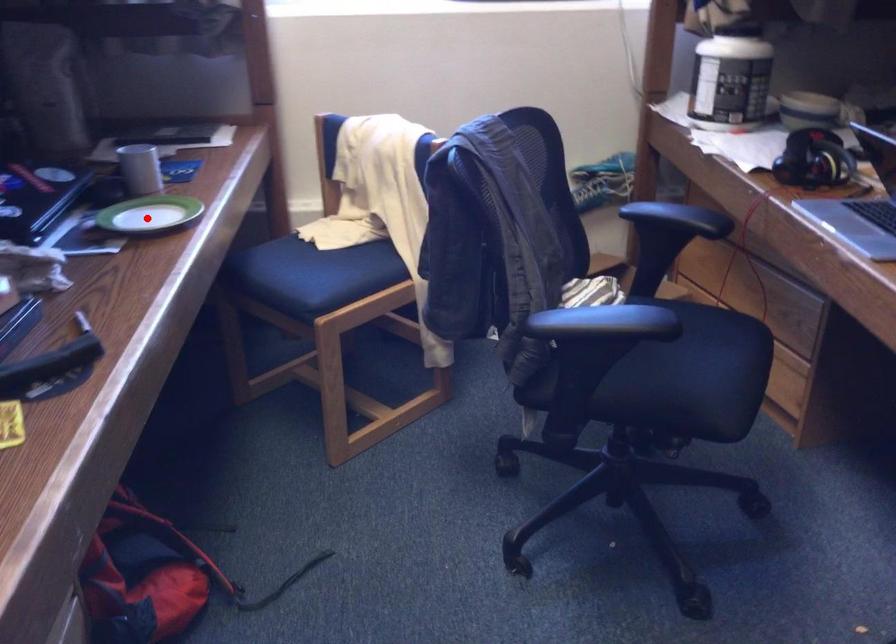
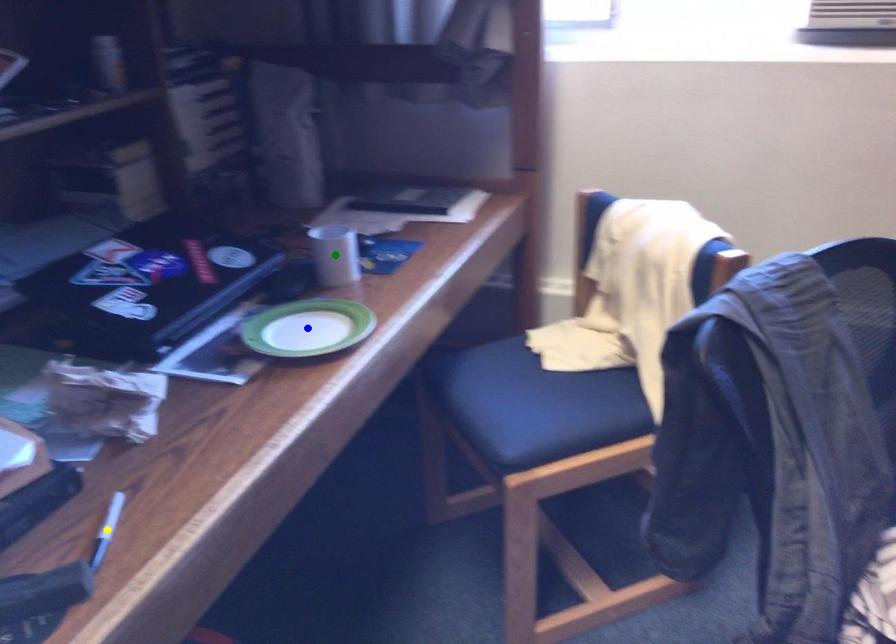
Question: I am providing you with two images of the same scene from different viewpoints. A red point is marked on the first image. You are given multiple points on the second image. Which spot in image 2 lines up with the point in image 1?

Choices:
 (A) yellow point
 (B) green point
 (C) blue point

Answer: (C)